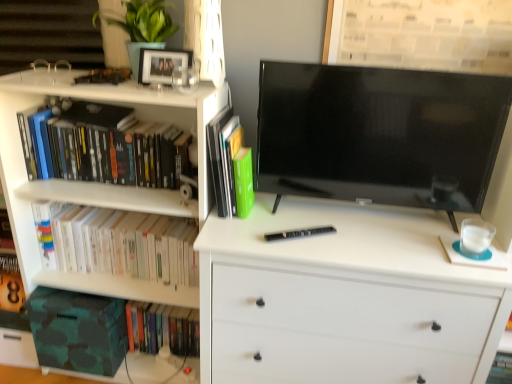
Image resolution: width=512 pixels, height=384 pixels. In order to click on empty space that is in between black matte pen at center and black glossy tv at center in this screenshot , I will do `click(324, 230)`.